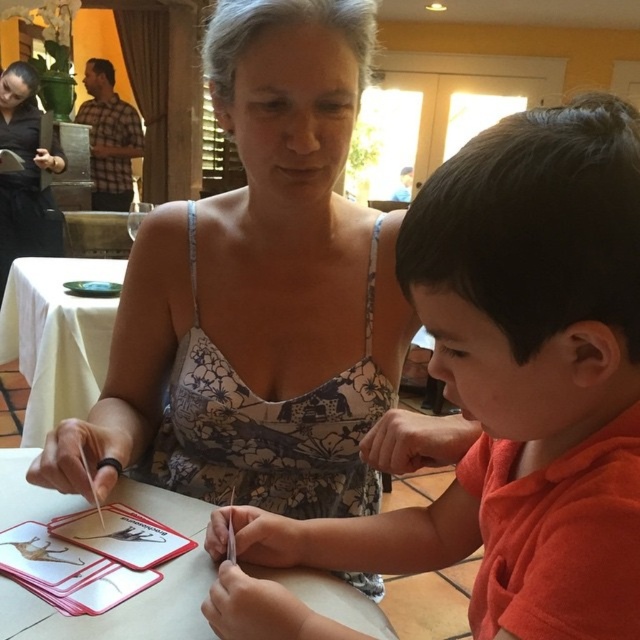
Is white cloth at lower left below black floral dress at center?

Yes.

Is white cloth at lower left shorter than black floral dress at center?

Yes.

Does point (44, 356) come farther from viewer compared to point (29, 188)?

No, (44, 356) is closer to viewer.

Locate an element on the screen. This screenshot has height=640, width=640. white cloth at lower left is located at coordinates click(56, 337).

Is orange matte shirt at center to the left of floral fabric dress at center from the viewer's perspective?

Incorrect, orange matte shirt at center is not on the left side of floral fabric dress at center.

Does orange matte shirt at center have a lesser height compared to floral fabric dress at center?

Correct, orange matte shirt at center is not as tall as floral fabric dress at center.

Identify the location of orange matte shirt at center. (520, 381).

Is floral fabric dress at center behind black floral dress at center?

That is False.

Looking at this image, is floral fabric dress at center shorter than black floral dress at center?

Yes, floral fabric dress at center is shorter than black floral dress at center.

You are a GUI agent. You are given a task and a screenshot of the screen. Output one action in this format:
    pyautogui.click(x=<x>, y=<y>)
    Task: Click on the floral fabric dress at center
    Image resolution: width=640 pixels, height=640 pixels.
    Given the screenshot: What is the action you would take?
    pyautogui.click(x=257, y=292)

Identify the location of floral fabric dress at center. (257, 292).